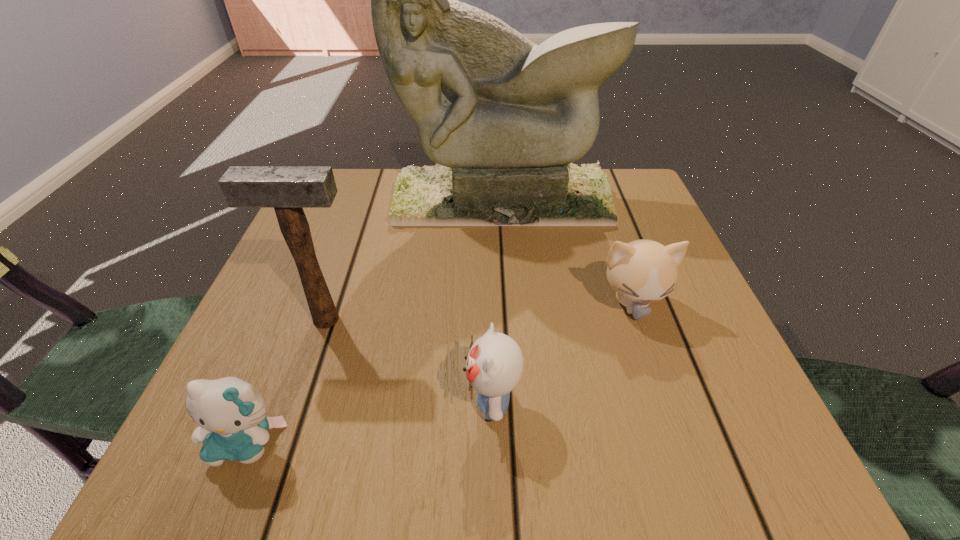
The image size is (960, 540). What are the coordinates of `vacant space located 0.130m on the front-facing side of the second kitten from right to left` in the screenshot? It's located at (374, 402).

I want to click on free spot located 0.240m on the front-facing side of the second kitten from right to left, so click(x=299, y=402).

Image resolution: width=960 pixels, height=540 pixels. Find the location of `object present at the far edge`. object present at the far edge is located at coordinates (501, 116).

Find the location of a particular element. This screenshot has height=540, width=960. mallet located at the left edge is located at coordinates (288, 189).

Locate an element on the screen. kitten at the left edge is located at coordinates (231, 414).

Find the location of `sculpture that is at the right edge`. sculpture that is at the right edge is located at coordinates coord(501,116).

Identify the location of kitten located at the right edge. (642, 271).

Image resolution: width=960 pixels, height=540 pixels. I want to click on object located in the near left corner section of the desktop, so click(231, 414).

Locate an element on the screen. object that is at the far right corner is located at coordinates pos(501,116).

The height and width of the screenshot is (540, 960). I want to click on vacant space at the near edge, so click(516, 450).